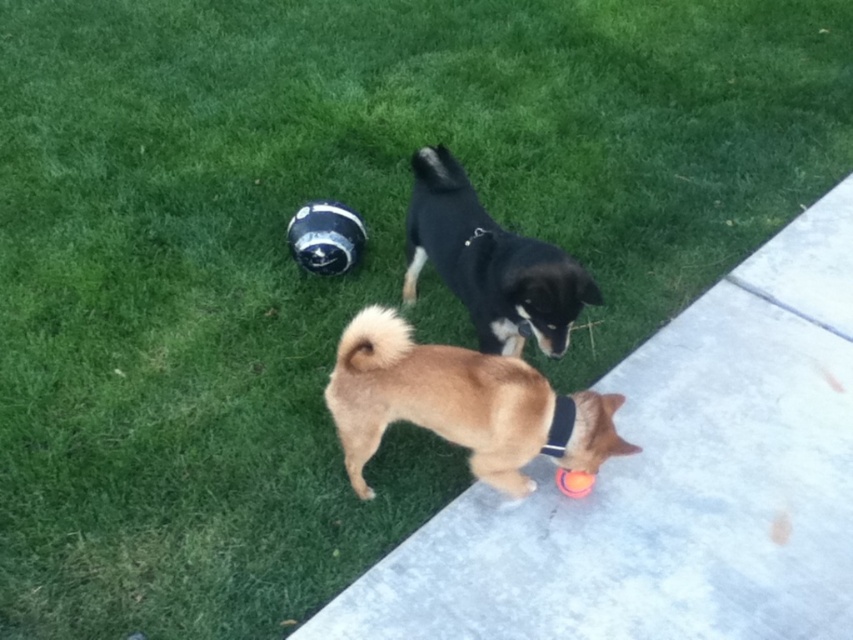
Can you confirm if brown furry dog at lower center is thinner than orange rubber ball at lower right?

No, brown furry dog at lower center is not thinner than orange rubber ball at lower right.

Between brown furry dog at lower center and orange rubber ball at lower right, which one has less height?

orange rubber ball at lower right is shorter.

Is point (363, 442) closer to camera compared to point (558, 474)?

That is True.

Identify the location of brown furry dog at lower center. (461, 404).

Does concrete at lower right appear over orange rubber ball at lower right?

Yes.

Is concrete at lower right wider than orange rubber ball at lower right?

Yes.

Describe the element at coordinates (670, 484) in the screenshot. I see `concrete at lower right` at that location.

This screenshot has width=853, height=640. What are the coordinates of `concrete at lower right` in the screenshot? It's located at (670, 484).

Which is above, brown furry dog at lower center or black fur dog at upper center?

black fur dog at upper center is higher up.

In the scene shown: Who is shorter, brown furry dog at lower center or black fur dog at upper center?

With less height is brown furry dog at lower center.

Is point (521, 442) more distant than point (416, 188)?

That is False.

You are a GUI agent. You are given a task and a screenshot of the screen. Output one action in this format:
    pyautogui.click(x=<x>, y=<y>)
    Task: Click on the brown furry dog at lower center
    The width and height of the screenshot is (853, 640).
    Given the screenshot: What is the action you would take?
    pyautogui.click(x=461, y=404)